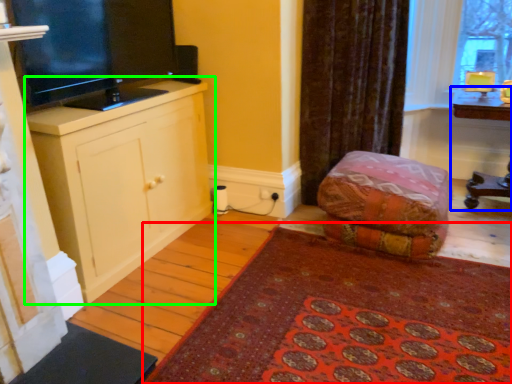
Question: Which object is positioned farthest from mat (highlighted by a red box)? Select from table (highlighted by a blue box) and cabinetry (highlighted by a green box).

Choices:
 (A) table
 (B) cabinetry

Answer: (A)